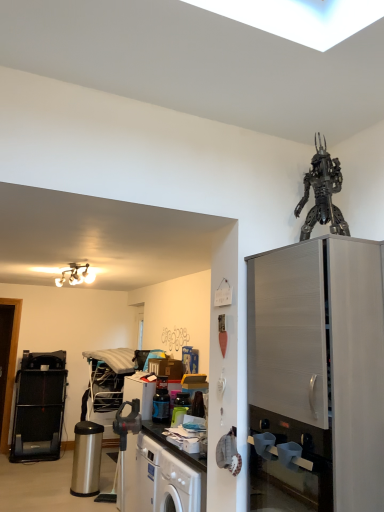
Measure the distance between point (53, 406) and camera.

18.30 feet.

The height and width of the screenshot is (512, 384). Describe the element at coordinates (39, 407) in the screenshot. I see `black plastic treadmill at left, positioned as the 1th appliance in left-to-right order` at that location.

In order to face metallic/reflective chandelier at upper left, should I rotate leftwards or rightwards?

To align with it, rotate left about 15.258°.

Find the location of `metallic/reflective chandelier at upper left`. metallic/reflective chandelier at upper left is located at coordinates (76, 275).

Locate an element on the screen. The image size is (384, 512). metallic robot at upper right is located at coordinates (322, 193).

The image size is (384, 512). Describe the element at coordinates (86, 459) in the screenshot. I see `stainless steel trash can at lower left, the 2th appliance when ordered from front to back` at that location.

The width and height of the screenshot is (384, 512). Find the location of `metallic blue blender at center, the 1th appliance from the front`. metallic blue blender at center, the 1th appliance from the front is located at coordinates (161, 401).

Does black plastic treadmill at left, arranged as the first appliance when viewed from the back, have a greater width compared to satin silver cabinet at right?

In fact, black plastic treadmill at left, arranged as the first appliance when viewed from the back, might be narrower than satin silver cabinet at right.

Who is bigger, black plastic treadmill at left, which ranks as the third appliance in right-to-left order, or satin silver cabinet at right?

With larger size is satin silver cabinet at right.

Considering the positions of objects black plastic treadmill at left, arranged as the first appliance when viewed from the back, and satin silver cabinet at right in the image provided, who is behind, black plastic treadmill at left, arranged as the first appliance when viewed from the back, or satin silver cabinet at right?

black plastic treadmill at left, arranged as the first appliance when viewed from the back.

The height and width of the screenshot is (512, 384). What are the coordinates of `the 3rd appliance behind the satin silver cabinet at right` in the screenshot? It's located at (39, 407).

How different are the orientations of metallic robot at upper right and metallic/reflective chandelier at upper left in degrees?

95.6 degrees.

Locate an element on the screen. This screenshot has height=512, width=384. toy lying above the metallic/reflective chandelier at upper left (from the image's perspective) is located at coordinates (322, 193).

Is metallic robot at upper right inside or outside of metallic/reflective chandelier at upper left?

metallic robot at upper right is not enclosed by metallic/reflective chandelier at upper left.

Is metallic blue blender at center, the 3th appliance viewed from the back, looking in the opposite direction of metallic robot at upper right?

No, metallic blue blender at center, the 3th appliance viewed from the back, is not facing the opposite direction of metallic robot at upper right.

Is metallic blue blender at center, marked as the 3th appliance in a left-to-right arrangement, shorter than metallic robot at upper right?

Yes, metallic blue blender at center, marked as the 3th appliance in a left-to-right arrangement, is shorter than metallic robot at upper right.

From a real-world perspective, which is physically above, metallic blue blender at center, the 1th appliance from the front, or metallic robot at upper right?

metallic robot at upper right is physically above.

Is point (164, 386) closer to camera compared to point (322, 185)?

No, (164, 386) is behind (322, 185).

Which is behind, black plastic treadmill at left, the third appliance viewed from the front, or stainless steel trash can at lower left, the second appliance when ordered from back to front?

black plastic treadmill at left, the third appliance viewed from the front, is behind.

Is there a large distance between black plastic treadmill at left, which ranks as the third appliance in right-to-left order, and stainless steel trash can at lower left, which ranks as the 2th appliance in right-to-left order?

black plastic treadmill at left, which ranks as the third appliance in right-to-left order, is far away from stainless steel trash can at lower left, which ranks as the 2th appliance in right-to-left order.

From a real-world perspective, is black plastic treadmill at left, which ranks as the third appliance in right-to-left order, over stainless steel trash can at lower left, which ranks as the 2th appliance in right-to-left order?

Correct, in the physical world, black plastic treadmill at left, which ranks as the third appliance in right-to-left order, is higher than stainless steel trash can at lower left, which ranks as the 2th appliance in right-to-left order.

Which is closer to the camera, (62, 371) or (85, 459)?

The point (85, 459) is closer.

The height and width of the screenshot is (512, 384). Find the location of `the 2nd appliance to the right of the black plastic treadmill at left, which ranks as the third appliance in right-to-left order, starting your count from the anchor`. the 2nd appliance to the right of the black plastic treadmill at left, which ranks as the third appliance in right-to-left order, starting your count from the anchor is located at coordinates (161, 401).

Between black plastic treadmill at left, positioned as the 1th appliance in left-to-right order, and metallic blue blender at center, marked as the 3th appliance in a left-to-right arrangement, which one has more height?

With more height is black plastic treadmill at left, positioned as the 1th appliance in left-to-right order.

Which point is more distant from viewer, (49, 429) or (153, 398)?

The point (49, 429) is farther.

From a real-world perspective, is black plastic treadmill at left, positioned as the 1th appliance in left-to-right order, below metallic blue blender at center, the 1th appliance when ordered from right to left?

Yes.

From a real-world perspective, is stainless steel trash can at lower left, the 2th appliance when ordered from front to back, under black plastic treadmill at left, which ranks as the third appliance in right-to-left order?

Yes, from a real-world perspective, stainless steel trash can at lower left, the 2th appliance when ordered from front to back, is below black plastic treadmill at left, which ranks as the third appliance in right-to-left order.

Consider the image. Which point is more forward, (x=72, y=476) or (x=53, y=368)?

The point (x=72, y=476) is in front.

Locate an element on the screen. The height and width of the screenshot is (512, 384). appliance beneath the black plastic treadmill at left, arranged as the first appliance when viewed from the back (from a real-world perspective) is located at coordinates (86, 459).

Which is correct: satin silver cabinet at right is inside metallic/reflective chandelier at upper left, or outside of it?

satin silver cabinet at right is located beyond the bounds of metallic/reflective chandelier at upper left.

Locate an element on the screen. cabinetry in front of the metallic/reflective chandelier at upper left is located at coordinates (317, 375).

From a real-world perspective, which object rests below the other?

satin silver cabinet at right, from a real-world perspective.

Is satin silver cabinet at right wider than metallic/reflective chandelier at upper left?

No, satin silver cabinet at right is not wider than metallic/reflective chandelier at upper left.

The image size is (384, 512). Identify the location of cabinetry above the black plastic treadmill at left, the third appliance viewed from the front (from the image's perspective). (317, 375).

Where is `light fixture below the metallic robot at upper right (from a real-world perspective)`? The height and width of the screenshot is (512, 384). light fixture below the metallic robot at upper right (from a real-world perspective) is located at coordinates (76, 275).

From the image, which object appears to be nearer to stainless steel trash can at lower left, which ranks as the 2th appliance in right-to-left order, satin silver cabinet at right or black plastic treadmill at left, which ranks as the third appliance in right-to-left order?

black plastic treadmill at left, which ranks as the third appliance in right-to-left order, is closer to stainless steel trash can at lower left, which ranks as the 2th appliance in right-to-left order.

Considering their positions, is metallic/reflective chandelier at upper left positioned further to metallic blue blender at center, the 1th appliance when ordered from right to left, than stainless steel trash can at lower left, the second appliance when ordered from back to front?

Among the two, stainless steel trash can at lower left, the second appliance when ordered from back to front, is located further to metallic blue blender at center, the 1th appliance when ordered from right to left.

Based on their spatial positions, is metallic robot at upper right or stainless steel trash can at lower left, the 2th appliance when ordered from front to back, further from metallic/reflective chandelier at upper left?

metallic robot at upper right is positioned further to the anchor metallic/reflective chandelier at upper left.

From the image, which object appears to be farther from metallic/reflective chandelier at upper left, metallic blue blender at center, the 3th appliance viewed from the back, or metallic robot at upper right?

The object further to metallic/reflective chandelier at upper left is metallic robot at upper right.

Based on their spatial positions, is satin silver cabinet at right or black plastic treadmill at left, positioned as the 1th appliance in left-to-right order, further from metallic/reflective chandelier at upper left?

satin silver cabinet at right lies further to metallic/reflective chandelier at upper left than the other object.

Estimate the real-world distances between objects in this image. Which object is further from stainless steel trash can at lower left, the 2th appliance when ordered from front to back, metallic blue blender at center, the 1th appliance from the front, or black plastic treadmill at left, positioned as the 1th appliance in left-to-right order?

metallic blue blender at center, the 1th appliance from the front, is further to stainless steel trash can at lower left, the 2th appliance when ordered from front to back.

Estimate the real-world distances between objects in this image. Which object is closer to metallic robot at upper right, metallic blue blender at center, the 3th appliance viewed from the back, or metallic/reflective chandelier at upper left?

metallic blue blender at center, the 3th appliance viewed from the back, is positioned closer to the anchor metallic robot at upper right.

When comparing their distances from stainless steel trash can at lower left, the 2th appliance when ordered from front to back, does black plastic treadmill at left, which ranks as the third appliance in right-to-left order, or satin silver cabinet at right seem further?

The object further to stainless steel trash can at lower left, the 2th appliance when ordered from front to back, is satin silver cabinet at right.

The height and width of the screenshot is (512, 384). In order to click on light fixture positioned between satin silver cabinet at right and black plastic treadmill at left, the third appliance viewed from the front, from near to far in this screenshot , I will do `click(76, 275)`.

Where is `appliance situated between black plastic treadmill at left, which ranks as the third appliance in right-to-left order, and metallic blue blender at center, the 1th appliance when ordered from right to left, from left to right`? appliance situated between black plastic treadmill at left, which ranks as the third appliance in right-to-left order, and metallic blue blender at center, the 1th appliance when ordered from right to left, from left to right is located at coordinates (86, 459).

I want to click on light fixture between metallic robot at upper right and stainless steel trash can at lower left, the 2th appliance when ordered from front to back, in the up-down direction, so click(76, 275).

Find the location of a particular element. light fixture between satin silver cabinet at right and stainless steel trash can at lower left, which ranks as the 2th appliance in right-to-left order, from front to back is located at coordinates 76,275.